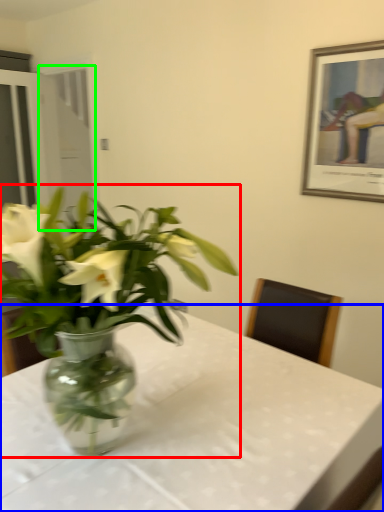
Question: Which is nearer to the houseplant (highlighted by a red box)? table (highlighted by a blue box) or glass door (highlighted by a green box).

Choices:
 (A) table
 (B) glass door

Answer: (A)